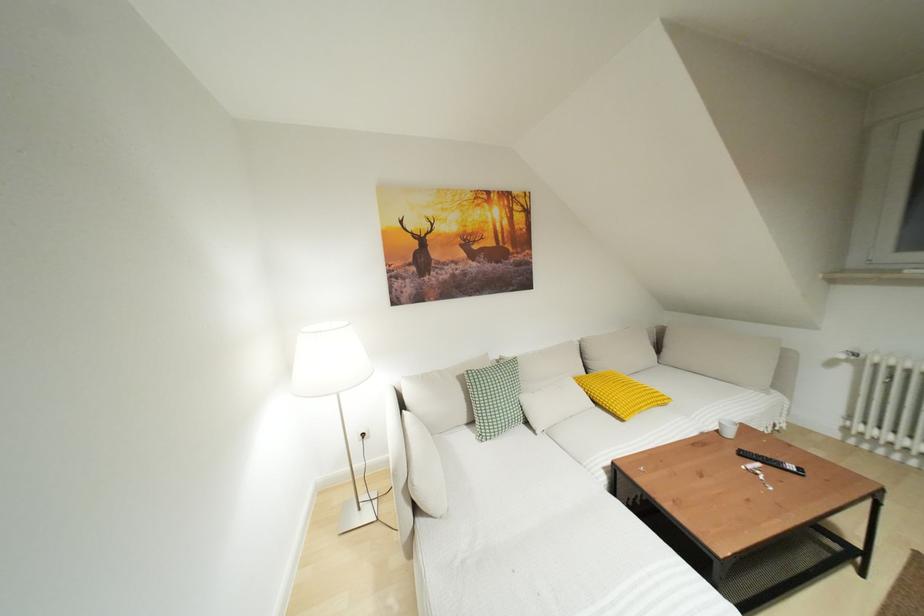
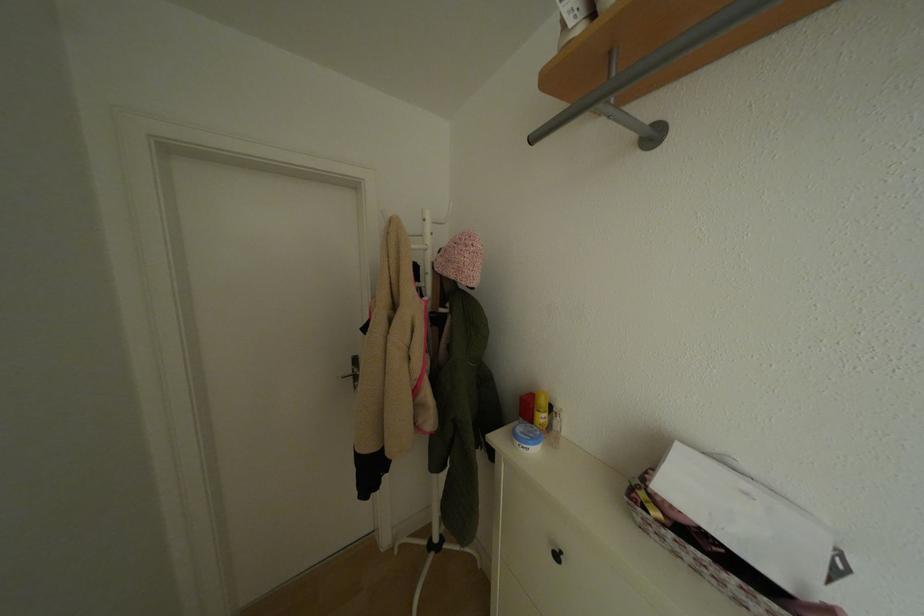
The images are taken continuously from a first-person perspective. In which direction are you moving?

The cameraman walked toward left, backward.